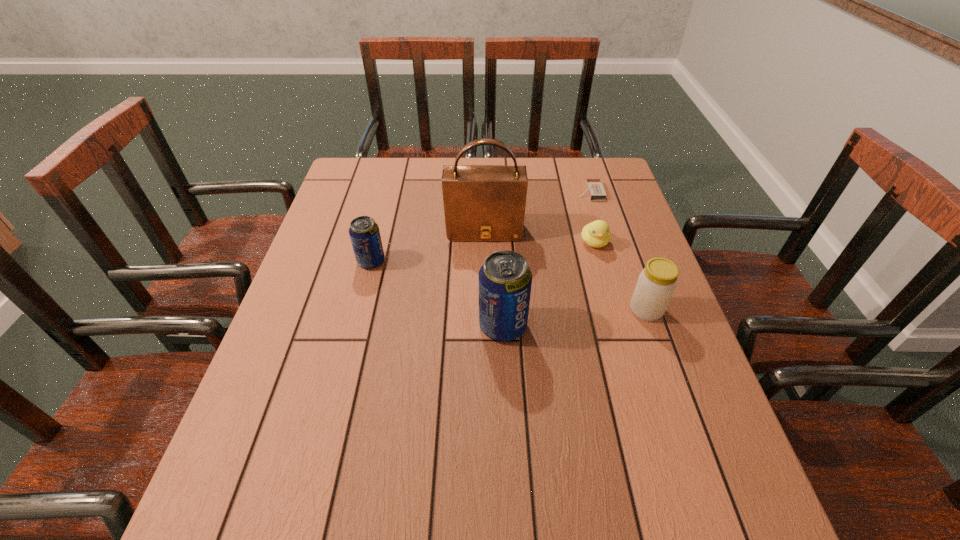
The image size is (960, 540). Find the location of `the leftmost object`. the leftmost object is located at coordinates (364, 232).

Identify the location of the shorter soda. Image resolution: width=960 pixels, height=540 pixels. (364, 232).

Where is `the right soda`? the right soda is located at coordinates (505, 279).

Locate an element on the screen. The width and height of the screenshot is (960, 540). the nearer soda is located at coordinates (505, 279).

At what (x,y) coordinates should I click in order to perform the action: click on the farthest object. Please return your answer as a coordinate pair (x, y). The width and height of the screenshot is (960, 540). Looking at the image, I should click on (595, 188).

The height and width of the screenshot is (540, 960). Find the location of `the shortest object`. the shortest object is located at coordinates (595, 188).

At what (x,y) coordinates should I click in order to perform the action: click on duckling. Please return your answer as a coordinate pair (x, y). This screenshot has width=960, height=540. Looking at the image, I should click on (596, 234).

Where is `shoulder bag`? This screenshot has width=960, height=540. shoulder bag is located at coordinates (481, 202).

Locate an element on the screen. jar is located at coordinates (656, 284).

Where is `vacant space situated 0.160m on the front of the leftmost object`? vacant space situated 0.160m on the front of the leftmost object is located at coordinates pos(356,319).